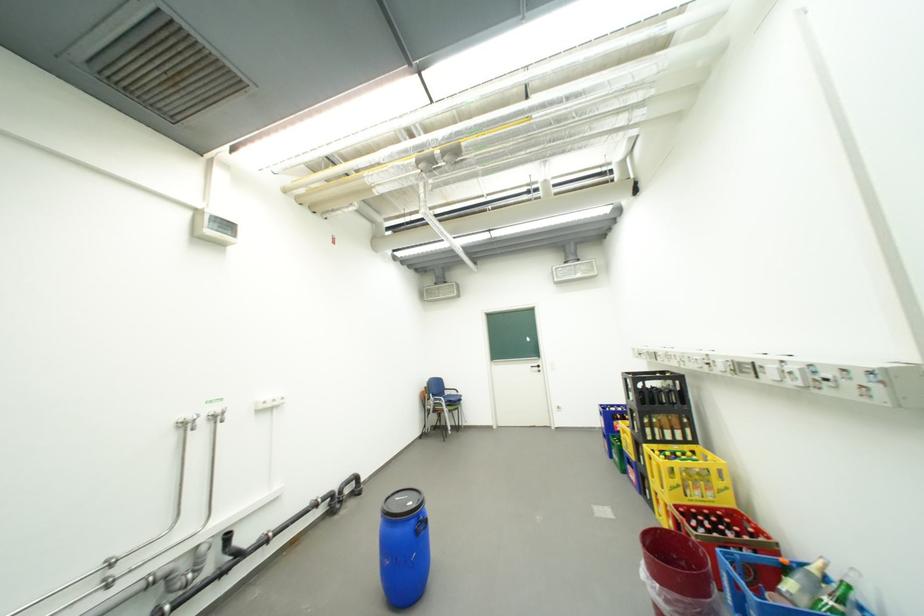
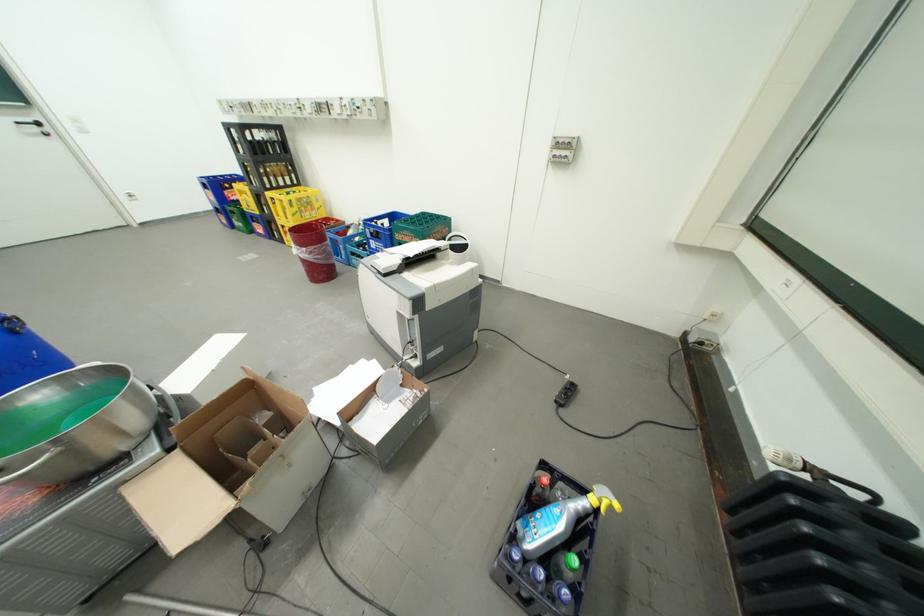
Where in the second image is the point corresponding to point 546,367 from the first image?

(41, 122)